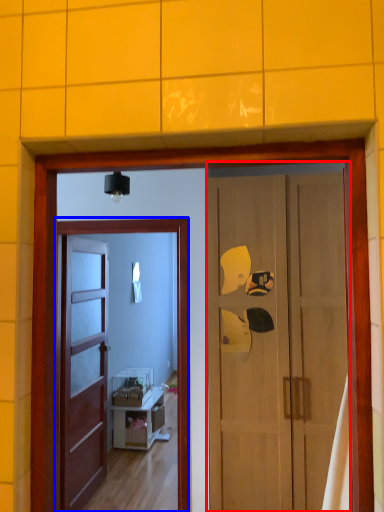
Question: Which object appears closest to the camera in this image, door (highlighted by a red box) or screen door (highlighted by a blue box)?

Choices:
 (A) door
 (B) screen door

Answer: (A)